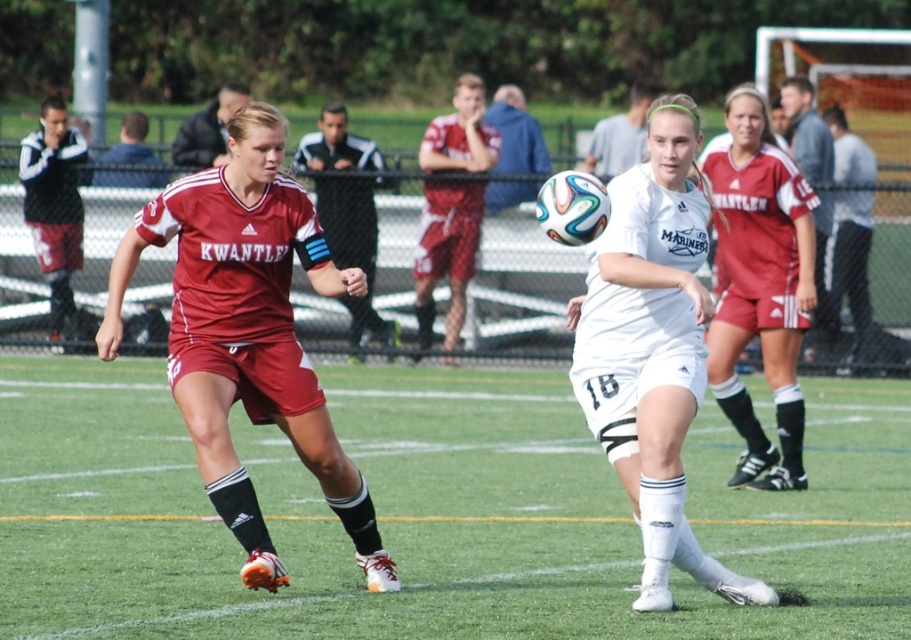
The width and height of the screenshot is (911, 640). What do you see at coordinates (428, 513) in the screenshot? I see `green grass at center` at bounding box center [428, 513].

The height and width of the screenshot is (640, 911). Identify the location of green grass at center. (428, 513).

Is white matte soccer ball at center above matte red shorts at center?

No, white matte soccer ball at center is not above matte red shorts at center.

Who is more forward, (627, 356) or (791, 269)?

Positioned in front is point (627, 356).

Is point (658, 248) farther from camera compared to point (787, 276)?

No, (658, 248) is closer to viewer.

The height and width of the screenshot is (640, 911). In order to click on white matte soccer ball at center in this screenshot , I will do `click(652, 348)`.

Which is behind, point (467, 432) or point (725, 192)?

The point (467, 432) is more distant.

Does green grass at center appear over matte red shorts at center?

Incorrect, green grass at center is not positioned above matte red shorts at center.

Between point (448, 472) and point (750, 90), which one is positioned in front?

Point (750, 90)

I want to click on green grass at center, so click(x=428, y=513).